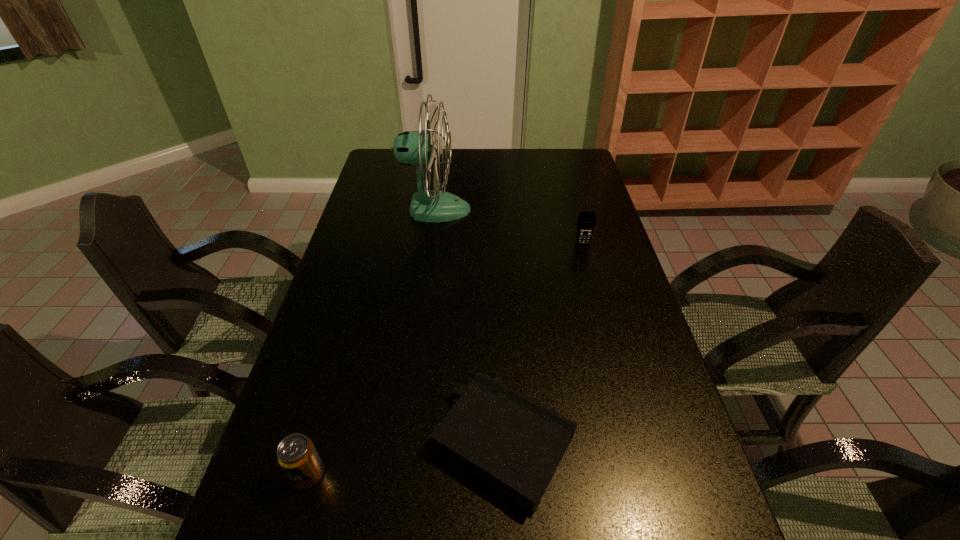
Where is `fan situated at the left edge`? fan situated at the left edge is located at coordinates [x=412, y=148].

Locate an element on the screen. soda can present at the left edge is located at coordinates (297, 456).

Locate an element on the screen. object that is at the right edge is located at coordinates (586, 222).

Where is `vacant space at the left edge of the desktop`? This screenshot has width=960, height=540. vacant space at the left edge of the desktop is located at coordinates (329, 292).

Find the location of `vacant area at the right edge of the desktop`. vacant area at the right edge of the desktop is located at coordinates (570, 247).

Where is `unoccupied position between the cellular telephone and the shortest object`? The height and width of the screenshot is (540, 960). unoccupied position between the cellular telephone and the shortest object is located at coordinates (543, 343).

Find the location of `vacant area that lies between the tallest object and the shortest object`. vacant area that lies between the tallest object and the shortest object is located at coordinates (469, 326).

Image resolution: width=960 pixels, height=540 pixels. I want to click on vacant area that lies between the cellular telephone and the soda can, so click(x=445, y=359).

Locate an element on the screen. This screenshot has height=540, width=960. vacant area that lies between the farthest object and the soda can is located at coordinates (372, 342).

Find the location of a particular element. Image resolution: width=960 pixels, height=540 pixels. free point between the shortest object and the soda can is located at coordinates (406, 458).